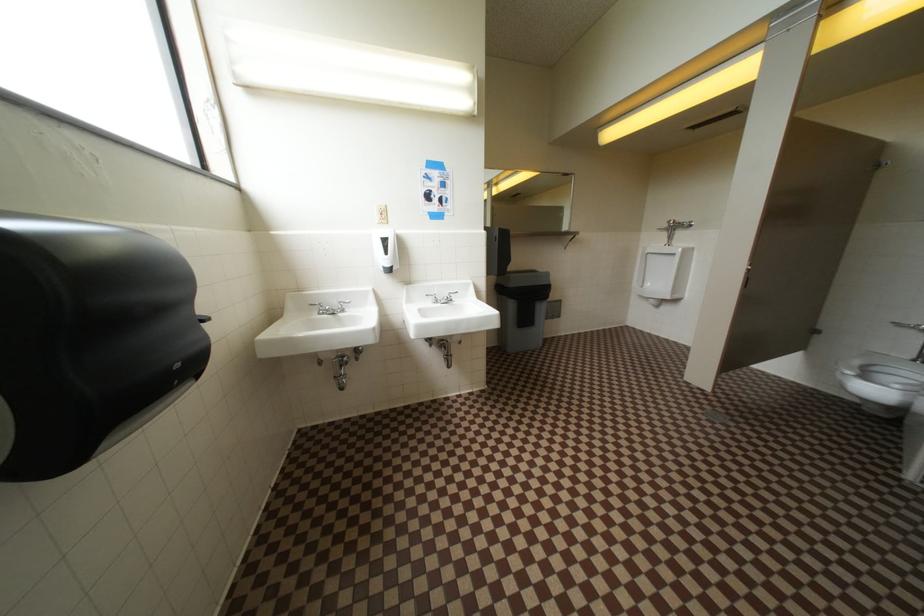
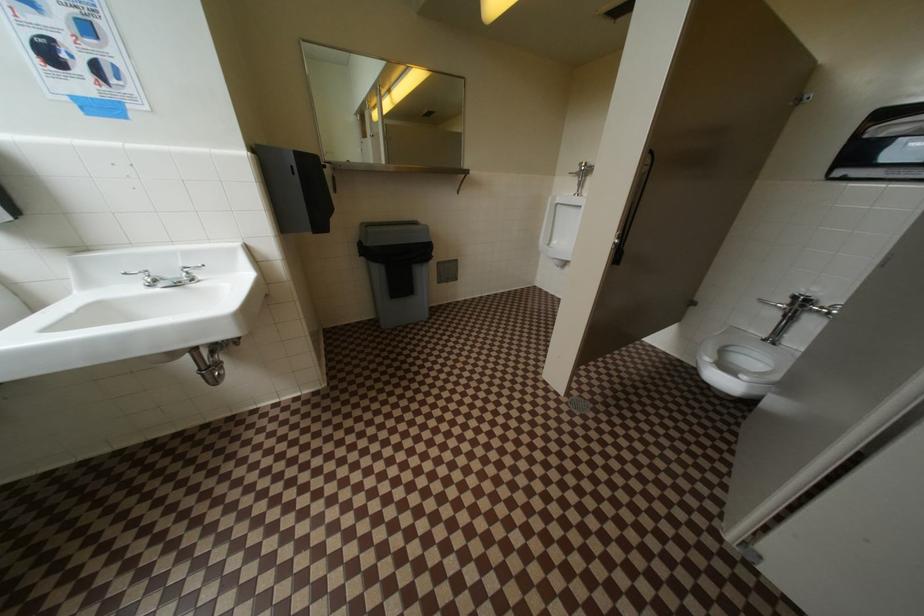
What movement of the cameraman would produce the second image?

The cameraman moved toward right, forward.